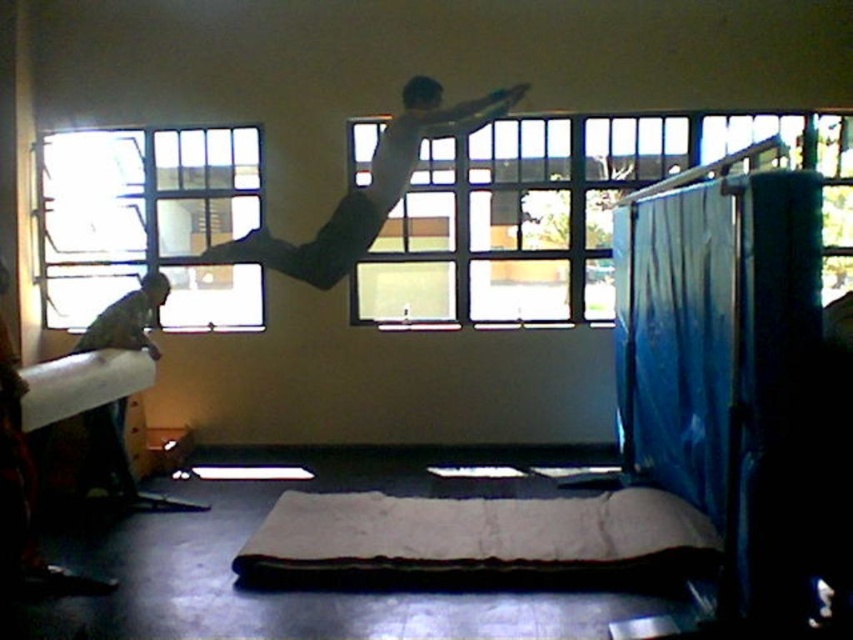
You are a photographer setting up a shoot in this room. You need to position a tripod so that it is directly in front of the gray fabric mat at center. Based on the coordinates provided, where should you place the tripod?

The gray fabric mat at center is located at point (476, 540), so you should place the tripod directly in front of this coordinate to position it correctly.

You are standing in the room and want to see outside through the clear glass window at upper left. However, the white matte shirt at upper center is blocking your view. Which object should you move to get a clear view?

You should move the white matte shirt at upper center because the clear glass window at upper left is located below it, so moving the shirt would allow you to see through the window without obstruction.

You are standing in the room and want to see outside through the clear glass window at upper left and the white cardboard at left. Which object allows you to see through it better?

The clear glass window at upper left allows you to see through it better than the white cardboard at left because it is made of transparent material.